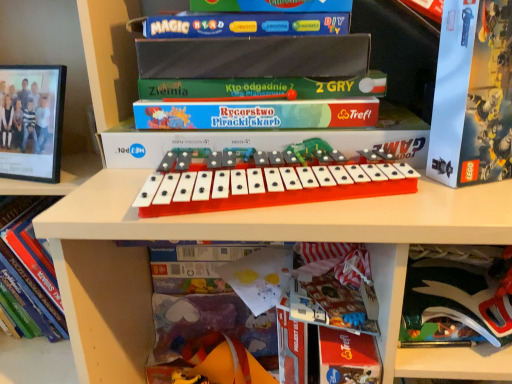
How much space does hardcover book at center, which appears as the first book when viewed from the right, occupy vertically?

hardcover book at center, which appears as the first book when viewed from the right, is 11.33 inches tall.

Where is `hardcover book at center, which appears as the first book when viewed from the right`? hardcover book at center, which appears as the first book when viewed from the right is located at coordinates (291, 346).

Describe the element at coordinates (272, 140) in the screenshot. I see `matte green board game at center, marked as the third paperback book in a bottom-to-top arrangement` at that location.

Find the location of `matte green board game at center, positioned as the 2th paperback book in top-to-bottom order`. matte green board game at center, positioned as the 2th paperback book in top-to-bottom order is located at coordinates (272, 140).

I want to click on white cardboard lego box at right, acting as the 1th paperback book starting from the top, so click(x=473, y=94).

The height and width of the screenshot is (384, 512). I want to click on rubber duck at lower center, so click(x=221, y=362).

The width and height of the screenshot is (512, 384). Identify the location of red paper at lower center, which appears as the 4th paperback book when viewed from the top. (348, 358).

Image resolution: width=512 pixels, height=384 pixels. What do you see at coordinates (211, 299) in the screenshot?
I see `matte paper book at lower center, which appears as the 2th book when viewed from the left` at bounding box center [211, 299].

What is the approximate width of matte paper book at lower center, which appears as the 2th book when viewed from the left?

The width of matte paper book at lower center, which appears as the 2th book when viewed from the left, is 2.52 inches.

This screenshot has height=384, width=512. Find the location of `orange plastic musical keyboard at center`. orange plastic musical keyboard at center is located at coordinates (268, 180).

Is matte green board game at center, marked as the third paperback book in a bottom-to-top arrangement, not near matte black scissors at lower right, which is counted as the second paperback book, starting from the bottom?

Actually, matte green board game at center, marked as the third paperback book in a bottom-to-top arrangement, and matte black scissors at lower right, which is counted as the second paperback book, starting from the bottom, are a little close together.

From a real-world perspective, is matte green board game at center, marked as the third paperback book in a bottom-to-top arrangement, located beneath matte black scissors at lower right, which is counted as the second paperback book, starting from the bottom?

No, from a real-world perspective, matte green board game at center, marked as the third paperback book in a bottom-to-top arrangement, is not under matte black scissors at lower right, which is counted as the second paperback book, starting from the bottom.

Based on the photo, considering the sizes of objects matte green board game at center, positioned as the 2th paperback book in top-to-bottom order, and matte black scissors at lower right, the 3th paperback book viewed from the top, in the image provided, who is smaller, matte green board game at center, positioned as the 2th paperback book in top-to-bottom order, or matte black scissors at lower right, the 3th paperback book viewed from the top,?

With smaller size is matte black scissors at lower right, the 3th paperback book viewed from the top.

From the image's perspective, which is below, matte green board game at center, positioned as the 2th paperback book in top-to-bottom order, or matte black scissors at lower right, the 3th paperback book viewed from the top?

matte black scissors at lower right, the 3th paperback book viewed from the top, appears lower in the image.

Can you tell me how much hardcover book at lower left, the third book positioned from the right, and white cardboard lego box at right, acting as the 1th paperback book starting from the top, differ in facing direction?

20.6 degrees separate the facing orientations of hardcover book at lower left, the third book positioned from the right, and white cardboard lego box at right, acting as the 1th paperback book starting from the top.

Can you confirm if hardcover book at lower left, the third book positioned from the right, is taller than white cardboard lego box at right, acting as the 1th paperback book starting from the top?

In fact, hardcover book at lower left, the third book positioned from the right, may be shorter than white cardboard lego box at right, acting as the 1th paperback book starting from the top.

Considering the positions of point (42, 284) and point (481, 0), is point (42, 284) closer or farther from the camera than point (481, 0)?

Clearly, point (42, 284) is more distant from the camera than point (481, 0).

Does hardcover book at lower left, the first book viewed from the left, appear on the left side of white cardboard lego box at right, arranged as the fourth paperback book when ordered from the bottom?

Correct, you'll find hardcover book at lower left, the first book viewed from the left, to the left of white cardboard lego box at right, arranged as the fourth paperback book when ordered from the bottom.

Can you confirm if matte paper book at lower center, which appears as the 2th book when viewed from the left, is positioned to the left of hardcover book at lower left, the first book viewed from the left?

No, matte paper book at lower center, which appears as the 2th book when viewed from the left, is not to the left of hardcover book at lower left, the first book viewed from the left.

There is a hardcover book at lower left, the first book viewed from the left. Where is `the 1st book below it (from the image's perspective)`? This screenshot has width=512, height=384. the 1st book below it (from the image's perspective) is located at coordinates (211, 299).

Between point (189, 287) and point (57, 318), which one is positioned behind?

The point (57, 318) is behind.

Is matte paper book at lower center, which appears as the 2th book when viewed from the left, looking in the opposite direction of hardcover book at lower left, the third book positioned from the right?

matte paper book at lower center, which appears as the 2th book when viewed from the left, is not turned away from hardcover book at lower left, the third book positioned from the right.

Would you say matte paper book at lower center, which appears as the 2th book when viewed from the left, is outside red paper at lower center, the 1th paperback book from the bottom?

Yes, matte paper book at lower center, which appears as the 2th book when viewed from the left, is outside of red paper at lower center, the 1th paperback book from the bottom.

Can you confirm if matte paper book at lower center, the 2th book in the right-to-left sequence, is shorter than red paper at lower center, the 1th paperback book from the bottom?

Yes.

From the image's perspective, is matte paper book at lower center, the 2th book in the right-to-left sequence, above red paper at lower center, the 1th paperback book from the bottom?

Yes, from the image's perspective, matte paper book at lower center, the 2th book in the right-to-left sequence, is above red paper at lower center, the 1th paperback book from the bottom.

Based on the photo, how many degrees apart are the facing directions of matte paper book at lower center, which appears as the 2th book when viewed from the left, and red paper at lower center, the 1th paperback book from the bottom?

matte paper book at lower center, which appears as the 2th book when viewed from the left, and red paper at lower center, the 1th paperback book from the bottom, are facing 0.14 degrees away from each other.

Is orange plastic musical keyboard at center to the right of rubber duck at lower center from the viewer's perspective?

Yes.

What's the angular difference between orange plastic musical keyboard at center and rubber duck at lower center's facing directions?

There is a 15.1-degree angle between the facing directions of orange plastic musical keyboard at center and rubber duck at lower center.

From a real-world perspective, is orange plastic musical keyboard at center above or below rubber duck at lower center?

In terms of real-world spatial position, orange plastic musical keyboard at center is above rubber duck at lower center.

There is a matte black scissors at lower right, which is counted as the second paperback book, starting from the bottom. Where is `the 3rd book below it (from a real-world perspective)`? The image size is (512, 384). the 3rd book below it (from a real-world perspective) is located at coordinates (291, 346).

Considering the sizes of objects matte black scissors at lower right, which is counted as the second paperback book, starting from the bottom, and hardcover book at center, which appears as the first book when viewed from the right, in the image provided, who is thinner, matte black scissors at lower right, which is counted as the second paperback book, starting from the bottom, or hardcover book at center, which appears as the first book when viewed from the right,?

hardcover book at center, which appears as the first book when viewed from the right, is thinner.

From a real-world perspective, is matte black scissors at lower right, the 3th paperback book viewed from the top, under hardcover book at center, which appears as the first book when viewed from the right?

No, from a real-world perspective, matte black scissors at lower right, the 3th paperback book viewed from the top, is not beneath hardcover book at center, which appears as the first book when viewed from the right.

Can you tell me how much matte black scissors at lower right, the 3th paperback book viewed from the top, and hardcover book at center, which appears as the first book when viewed from the right, differ in facing direction?

10.1 degrees separate the facing orientations of matte black scissors at lower right, the 3th paperback book viewed from the top, and hardcover book at center, which appears as the first book when viewed from the right.

Identify the location of toy below the hardcover book at lower left, the third book positioned from the right (from a real-world perspective). This screenshot has width=512, height=384. (221, 362).

Is rubber duck at lower center bigger or smaller than hardcover book at lower left, the first book viewed from the left?

In the image, rubber duck at lower center appears to be smaller than hardcover book at lower left, the first book viewed from the left.

This screenshot has width=512, height=384. In order to click on the 2nd paperback book to the left when counting from the matte black scissors at lower right, the 3th paperback book viewed from the top in this screenshot , I will do coord(272,140).

Identify the location of book that is the 1st one below the white cardboard lego box at right, acting as the 1th paperback book starting from the top (from a real-world perspective). The width and height of the screenshot is (512, 384). (30, 261).

When comparing their distances from red paper at lower center, the 1th paperback book from the bottom, does white cardboard lego box at right, arranged as the fourth paperback book when ordered from the bottom, or matte green board game at center, positioned as the 2th paperback book in top-to-bottom order, seem further?

The object further to red paper at lower center, the 1th paperback book from the bottom, is white cardboard lego box at right, arranged as the fourth paperback book when ordered from the bottom.

Which object lies nearer to the anchor point rubber duck at lower center, orange plastic musical keyboard at center or matte green board game at center, positioned as the 2th paperback book in top-to-bottom order?

Among the two, orange plastic musical keyboard at center is located nearer to rubber duck at lower center.

When comparing their distances from orange plastic musical keyboard at center, does hardcover book at lower left, the first book viewed from the left, or matte green board game at center, positioned as the 2th paperback book in top-to-bottom order, seem closer?

matte green board game at center, positioned as the 2th paperback book in top-to-bottom order, is closer to orange plastic musical keyboard at center.

Considering their positions, is hardcover book at lower left, the third book positioned from the right, positioned further to matte paper book at lower center, the 2th book in the right-to-left sequence, than rubber duck at lower center?

hardcover book at lower left, the third book positioned from the right.

Based on their spatial positions, is matte green board game at center, positioned as the 2th paperback book in top-to-bottom order, or matte black scissors at lower right, which is counted as the second paperback book, starting from the bottom, closer to matte paper book at lower center, which appears as the 2th book when viewed from the left?

Based on the image, matte black scissors at lower right, which is counted as the second paperback book, starting from the bottom, appears to be nearer to matte paper book at lower center, which appears as the 2th book when viewed from the left.

Considering their positions, is hardcover book at lower left, the first book viewed from the left, positioned closer to matte green board game at center, marked as the third paperback book in a bottom-to-top arrangement, than matte paper book at lower center, which appears as the 2th book when viewed from the left?

The object closer to matte green board game at center, marked as the third paperback book in a bottom-to-top arrangement, is matte paper book at lower center, which appears as the 2th book when viewed from the left.

When comparing their distances from red paper at lower center, which appears as the 4th paperback book when viewed from the top, does hardcover book at center, which is counted as the third book, starting from the left, or white cardboard lego box at right, arranged as the fourth paperback book when ordered from the bottom, seem closer?

hardcover book at center, which is counted as the third book, starting from the left, is positioned closer to the anchor red paper at lower center, which appears as the 4th paperback book when viewed from the top.

Which object lies nearer to the anchor point hardcover book at center, which is counted as the third book, starting from the left, matte paper book at lower center, the 2th book in the right-to-left sequence, or rubber duck at lower center?

matte paper book at lower center, the 2th book in the right-to-left sequence, is positioned closer to the anchor hardcover book at center, which is counted as the third book, starting from the left.

The height and width of the screenshot is (384, 512). I want to click on book between hardcover book at lower left, the third book positioned from the right, and orange plastic musical keyboard at center from left to right, so tap(211, 299).

The image size is (512, 384). In order to click on toy between hardcover book at lower left, the third book positioned from the right, and red paper at lower center, the 1th paperback book from the bottom in this screenshot , I will do `click(221, 362)`.

What are the coordinates of `paperback book between matte green board game at center, marked as the third paperback book in a bottom-to-top arrangement, and red paper at lower center, which appears as the 4th paperback book when viewed from the top, from top to bottom` in the screenshot? It's located at (458, 292).

At what (x,y) coordinates should I click in order to perform the action: click on book between red paper at lower center, the 1th paperback book from the bottom, and matte paper book at lower center, which appears as the 2th book when viewed from the left, from front to back. Please return your answer as a coordinate pair (x, y). This screenshot has height=384, width=512. Looking at the image, I should click on (291, 346).